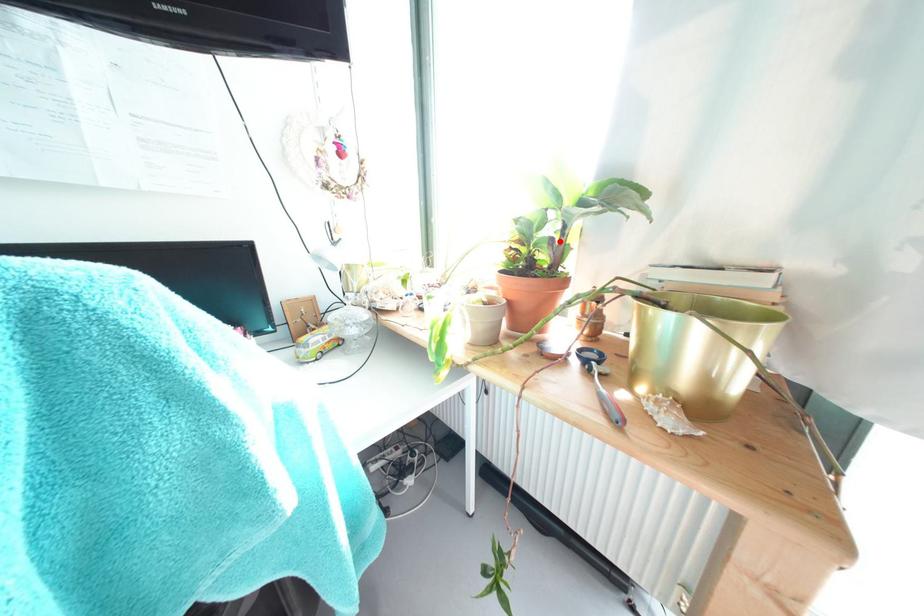
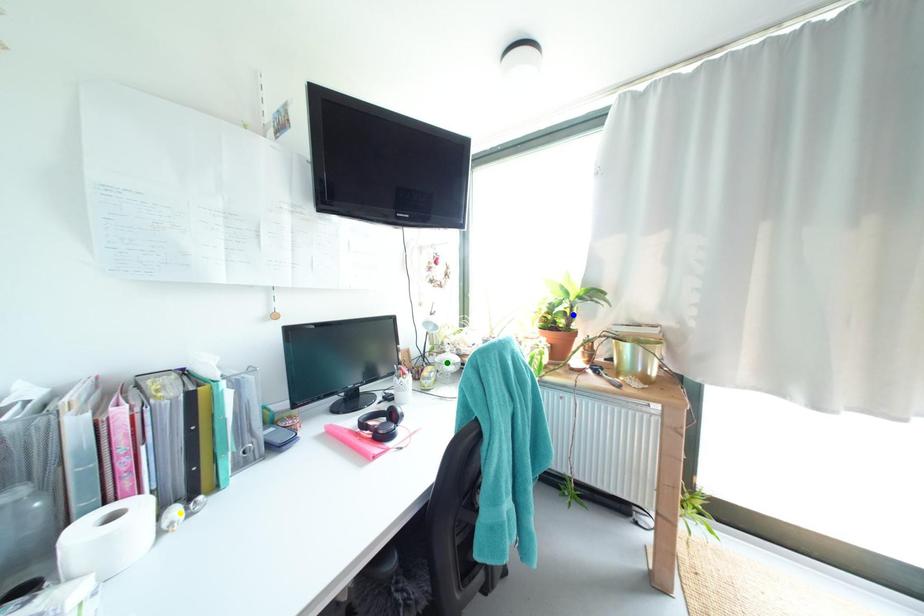
Question: I am providing you with two images of the same scene from different viewpoints. A red point is marked on the first image. You are given multiple points on the second image. In image 2, which mark is for the same physical point as the one in image 1?

Choices:
 (A) green point
 (B) blue point
 (C) yellow point

Answer: (B)